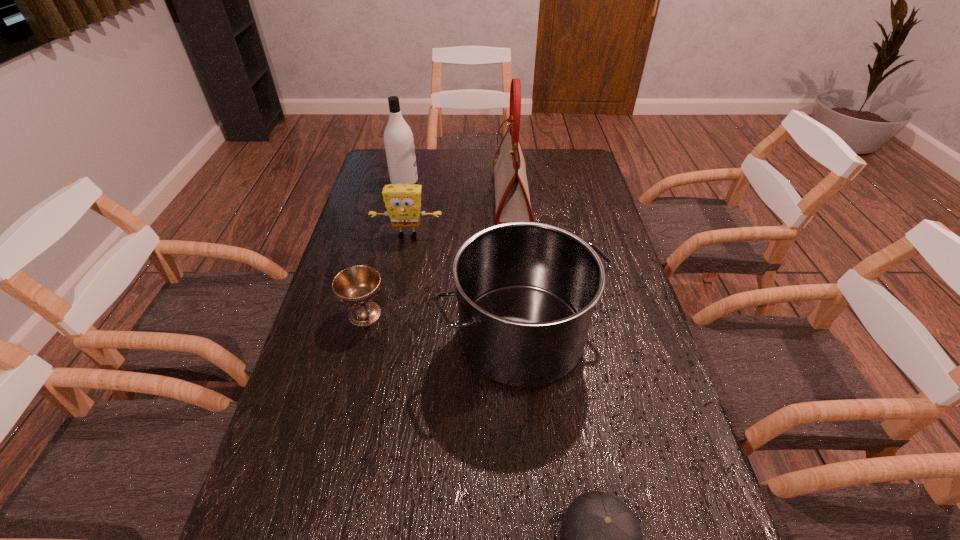
The image size is (960, 540). What are the coordinates of `vacant area at the far right corner of the desktop` in the screenshot? It's located at (568, 178).

I want to click on vacant region between the handbag and the fifth tallest object, so click(438, 255).

This screenshot has width=960, height=540. In order to click on free point between the saucepan and the second shortest object in this screenshot , I will do `click(443, 326)`.

Image resolution: width=960 pixels, height=540 pixels. What are the coordinates of `free point between the third shortest object and the handbag` in the screenshot? It's located at (x=460, y=217).

At what (x,y) coordinates should I click in order to perform the action: click on free space between the handbag and the sponge. Please return your answer as a coordinate pair (x, y). Image resolution: width=960 pixels, height=540 pixels. Looking at the image, I should click on (460, 217).

I want to click on vacant area that lies between the chalice and the saucepan, so (x=443, y=326).

Identify which object is the third nearest to the shampoo. Please provide its 2D coordinates. Your answer should be formatted as a tuple, i.e. [(x, y)], where the tuple contains the x and y coordinates of a point satisfying the conditions above.

[(526, 291)]

Identify which object is the fifth closest to the sponge. Please provide its 2D coordinates. Your answer should be formatted as a tuple, i.e. [(x, y)], where the tuple contains the x and y coordinates of a point satisfying the conditions above.

[(600, 537)]

At what (x,y) coordinates should I click in order to perform the action: click on vacant space that satisfies the following two spatial constraints: 1. on the front-facing side of the fifth shortest object; 2. on the left side of the third tallest object. Please return your answer as a coordinate pair (x, y). Looking at the image, I should click on (369, 337).

At what (x,y) coordinates should I click in order to perform the action: click on blank space that satisfies the following two spatial constraints: 1. on the face of the saucepan; 2. on the right side of the sponge. Please return your answer as a coordinate pair (x, y). Image resolution: width=960 pixels, height=540 pixels. Looking at the image, I should click on (389, 337).